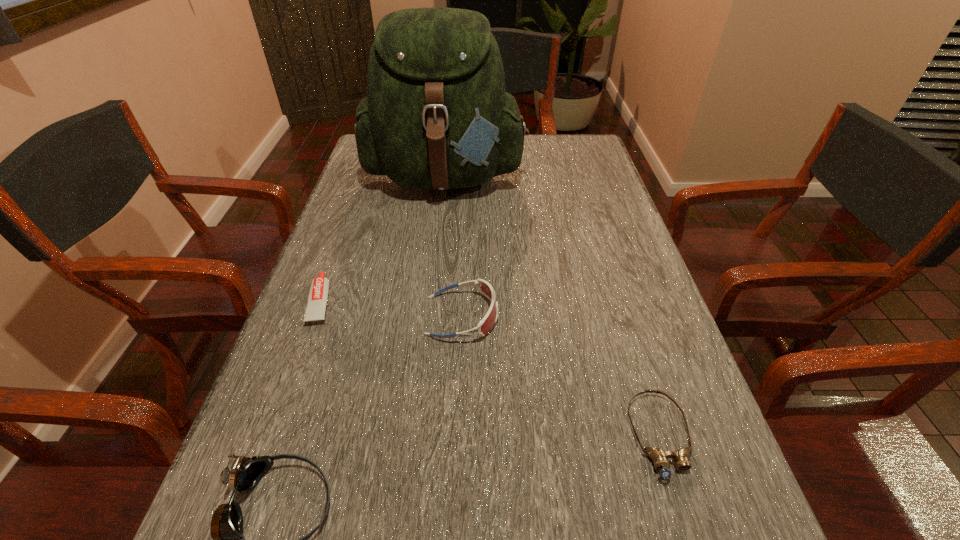
Where is `vacant area that lies between the rightmost goggles and the toothpaste`? vacant area that lies between the rightmost goggles and the toothpaste is located at coordinates (491, 368).

The width and height of the screenshot is (960, 540). What are the coordinates of `vacant area between the second goggles from right to left and the rightmost object` in the screenshot? It's located at (561, 376).

Find the location of `vacant space that's between the rightmost object and the backpack`. vacant space that's between the rightmost object and the backpack is located at coordinates (553, 306).

The image size is (960, 540). Identify the location of object that is the closest to the farthest goggles. [318, 294].

Locate which object is the third closest to the leftmost goggles. Please provide its 2D coordinates. Your answer should be formatted as a tuple, i.e. [(x, y)], where the tuple contains the x and y coordinates of a point satisfying the conditions above.

[(659, 457)]

Point out which goggles is positioned as the third nearest to the backpack. Please provide its 2D coordinates. Your answer should be formatted as a tuple, i.e. [(x, y)], where the tuple contains the x and y coordinates of a point satisfying the conditions above.

[(227, 521)]

You are a GUI agent. You are given a task and a screenshot of the screen. Output one action in this format:
    pyautogui.click(x=<x>, y=<y>)
    Task: Click on the third closest goggles to the tallest object
    This screenshot has height=540, width=960.
    Given the screenshot: What is the action you would take?
    pyautogui.click(x=227, y=521)